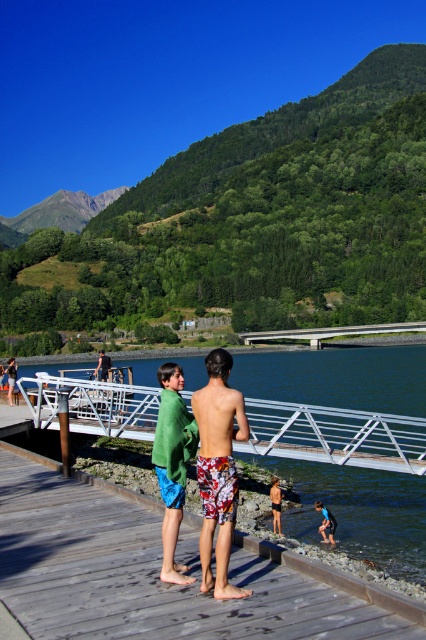
You are standing at the lakeside and want to cross to the other side. The wooden dock at center and the white concrete bridge at center are both options. Which one is physically closer to you?

The wooden dock at center is closer to the viewer than the white concrete bridge at center, so you should choose the wooden dock at center to cross first since it is nearer.